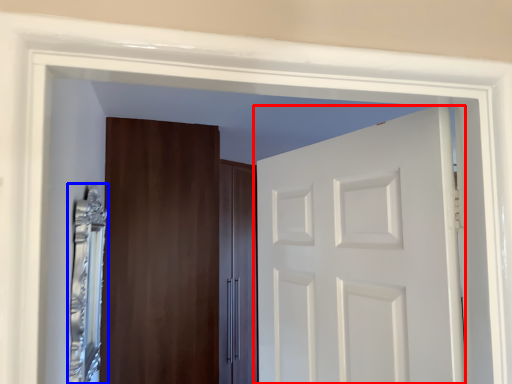
Question: Which of the following is the closest to the observer, door (highlighted by a red box) or mirror (highlighted by a blue box)?

Choices:
 (A) door
 (B) mirror

Answer: (A)